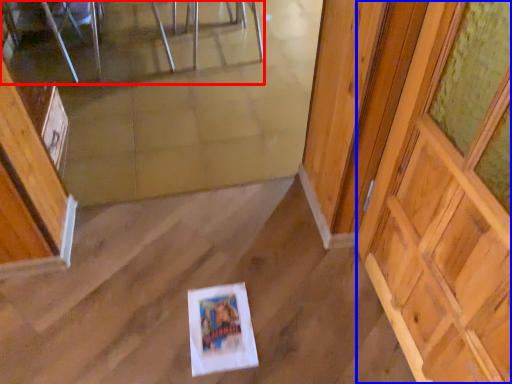
Question: Which object is closer to the camera taking this photo, furniture (highlighted by a red box) or barn door (highlighted by a blue box)?

Choices:
 (A) furniture
 (B) barn door

Answer: (B)